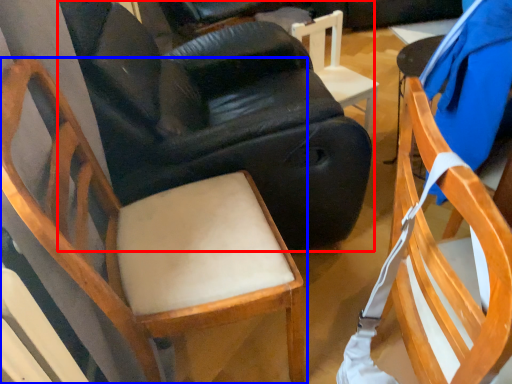
Question: Which of the following is the farthest to the observer, chair (highlighted by a red box) or chair (highlighted by a blue box)?

Choices:
 (A) chair
 (B) chair

Answer: (A)